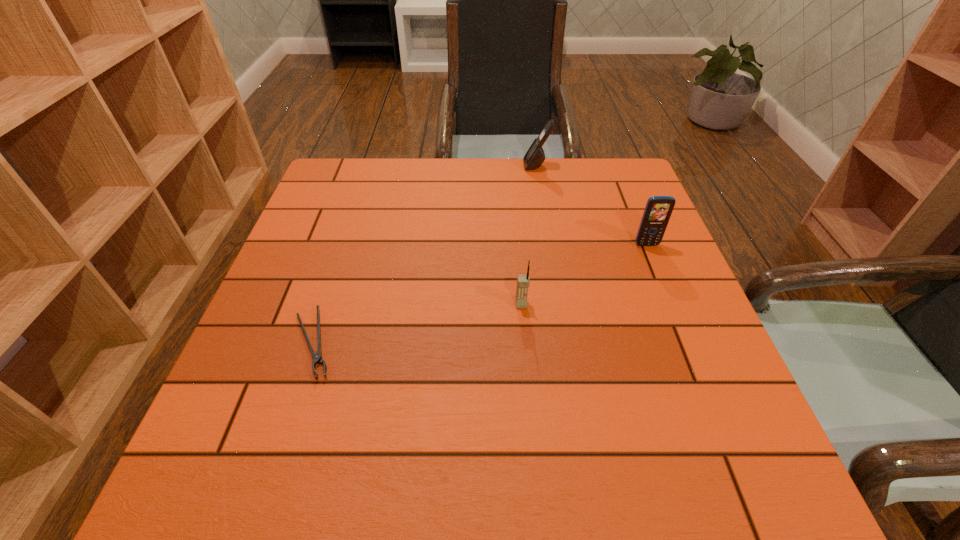
Where is `the farthest object`? the farthest object is located at coordinates (535, 156).

Where is `the second object from right to left`? This screenshot has height=540, width=960. the second object from right to left is located at coordinates (535, 156).

At what (x,y) coordinates should I click in order to perform the action: click on the third nearest object. Please return your answer as a coordinate pair (x, y). Looking at the image, I should click on (658, 209).

The image size is (960, 540). I want to click on the rightmost object, so click(658, 209).

Where is `the nearest cellular telephone`? the nearest cellular telephone is located at coordinates (523, 281).

Locate an element on the screen. This screenshot has height=540, width=960. the second object from left to right is located at coordinates (523, 281).

The width and height of the screenshot is (960, 540). What are the coordinates of `the shortest object` in the screenshot? It's located at (317, 358).

Locate an element on the screen. Image resolution: width=960 pixels, height=540 pixels. the nearest object is located at coordinates (317, 358).

Identify the location of blank space located on the front-facing side of the second cellular telephone from left to right. (491, 165).

At what (x,y) coordinates should I click in order to perform the action: click on free region located on the front-facing side of the second cellular telephone from left to right. Please return your answer as a coordinate pair (x, y). The height and width of the screenshot is (540, 960). Looking at the image, I should click on (422, 165).